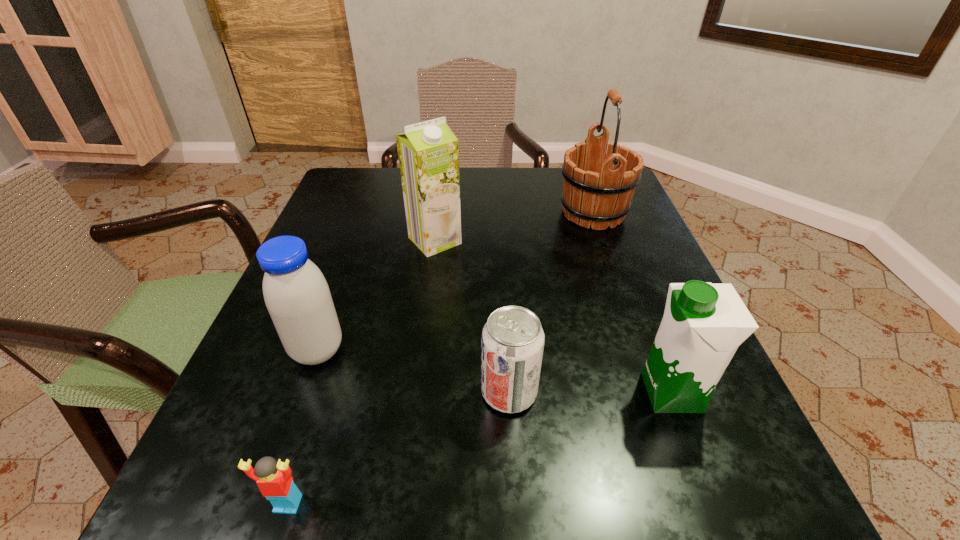
Find the location of a particular element. The height and width of the screenshot is (540, 960). the second closest object to the tallest soya milk is located at coordinates (598, 186).

Find the location of a particular element. the closest soya milk to the leftmost soya milk is located at coordinates (428, 152).

Locate which soya milk is the second closest to the tallest soya milk. Please provide its 2D coordinates. Your answer should be formatted as a tuple, i.e. [(x, y)], where the tuple contains the x and y coordinates of a point satisfying the conditions above.

[(703, 325)]

Where is `free region that satisfies the following two spatial constraints: 1. on the back side of the leftmost soya milk; 2. on the right side of the wine bucket`? This screenshot has width=960, height=540. free region that satisfies the following two spatial constraints: 1. on the back side of the leftmost soya milk; 2. on the right side of the wine bucket is located at coordinates (367, 213).

Find the location of a particular element. The image size is (960, 540). vacant area in the image that satisfies the following two spatial constraints: 1. on the front side of the second soya milk from right to left; 2. on the left side of the fourth object from left to right is located at coordinates (416, 392).

I want to click on vacant area in the image that satisfies the following two spatial constraints: 1. on the front side of the leftmost soya milk; 2. on the left side of the third object from right to left, so click(303, 392).